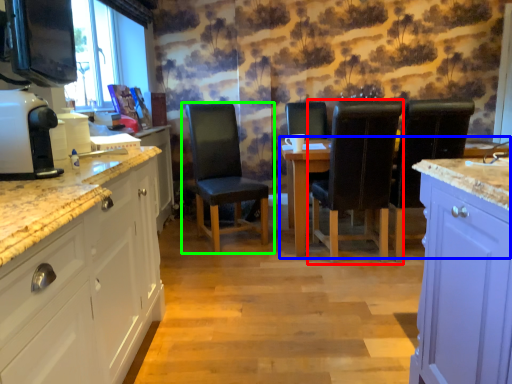
Question: Which is nearer to the chair (highlighted by a red box)? kitchen & dining room table (highlighted by a blue box) or chair (highlighted by a green box).

Choices:
 (A) kitchen & dining room table
 (B) chair

Answer: (A)